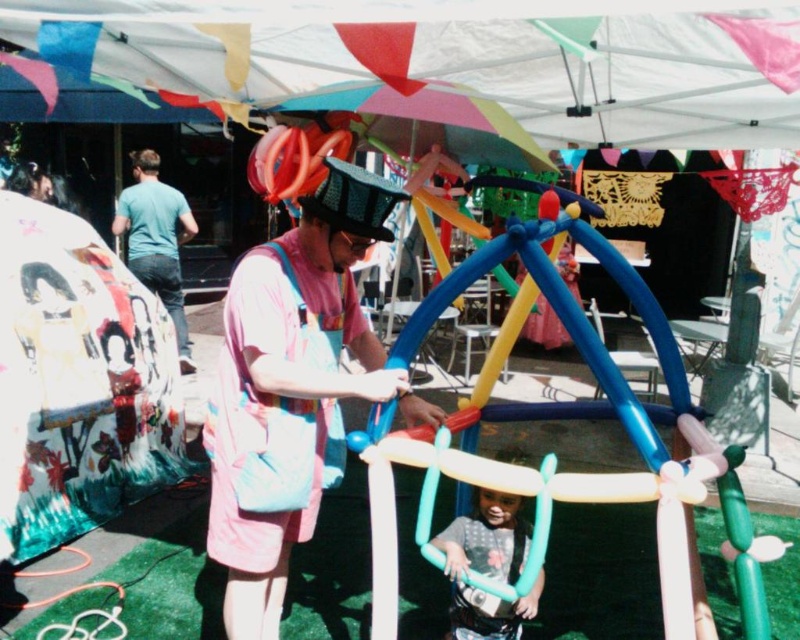
Question: Which of these objects is positioned farthest from the multicolored balloon structure at center?

Choices:
 (A) multicolored fabric canopy at upper center
 (B) teal t-shirt at left
 (C) pink fabric bag at center
 (D) matte blue balloon at center

Answer: (B)

Question: Does multicolored balloon structure at center lie in front of matte blue balloon at center?

Choices:
 (A) no
 (B) yes

Answer: (B)

Question: Which point is farther to the camera?

Choices:
 (A) teal t-shirt at left
 (B) multicolored fabric canopy at upper center

Answer: (A)

Question: Is multicolored fabric canopy at upper center thinner than pink fabric bag at center?

Choices:
 (A) yes
 (B) no

Answer: (B)

Question: Can you confirm if pink fabric bag at center is positioned to the right of matte blue balloon at center?

Choices:
 (A) no
 (B) yes

Answer: (A)

Question: Which of the following is the closest to the observer?

Choices:
 (A) multicolored balloon structure at center
 (B) teal t-shirt at left

Answer: (A)